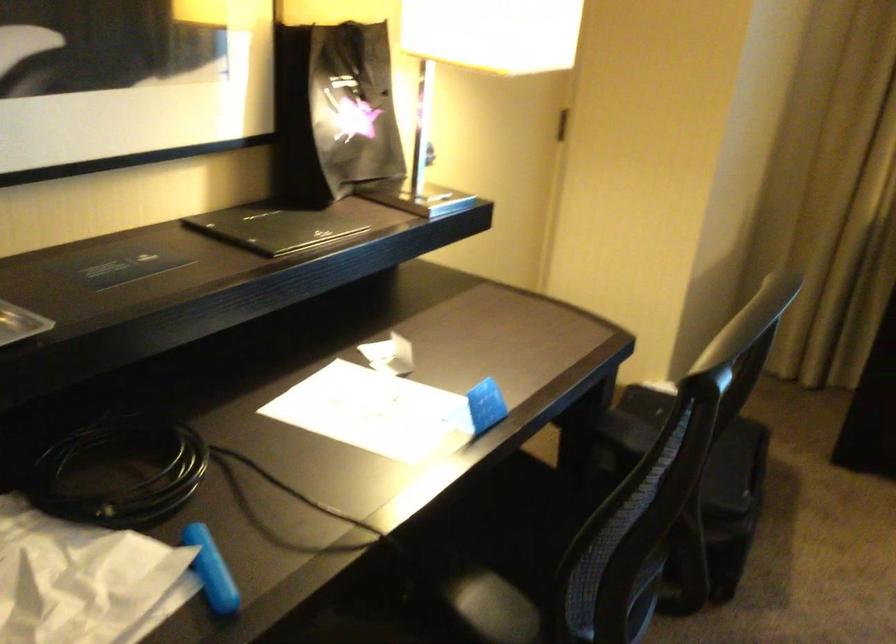
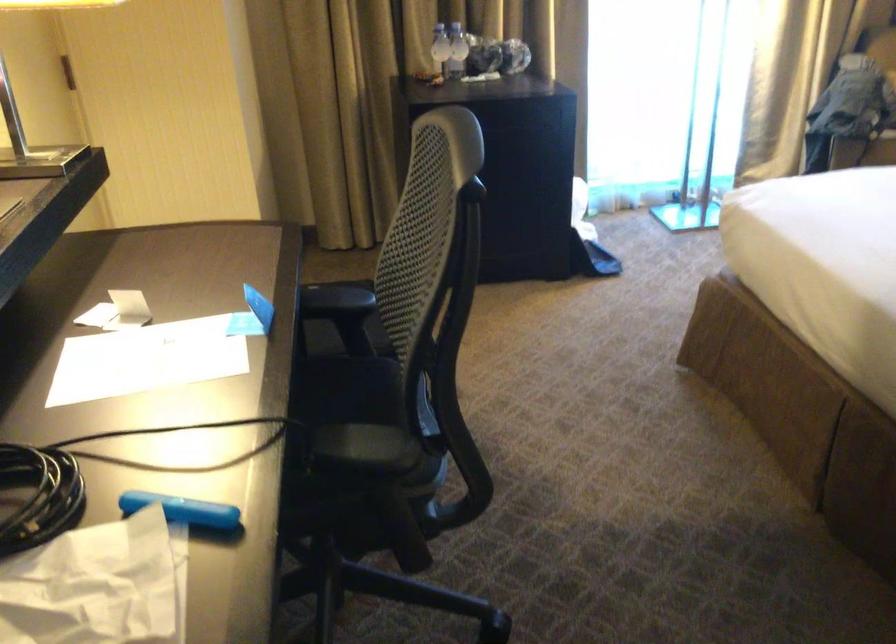
Question: The camera is either moving clockwise (left) or counter-clockwise (right) around the object. The first image is from the beginning of the video and the second image is from the end. Is the camera moving left or right when shooting the video?

Choices:
 (A) Left
 (B) Right

Answer: (A)